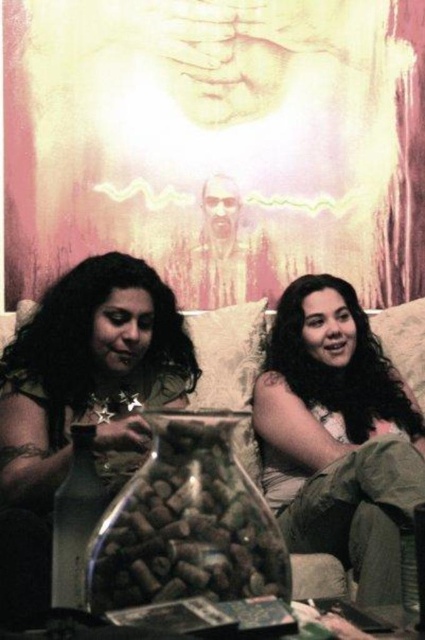
You are a photographer trying to capture a closeup of the matte beige hair at center and the matte gold bracelet at left. Which object should you zoom in on to ensure both are in focus without moving the camera?

The matte beige hair at center has a lesser width compared to matte gold bracelet at left, so you should focus on the matte gold bracelet at left because it is wider and will remain in focus more easily when zooming in.

You are a photographer adjusting your camera settings. You notice the matte beige hair at center and the matte gold bracelet at left in your frame. Which object is positioned lower in the image?

The matte beige hair at center is positioned lower than the matte gold bracelet at left in the image.